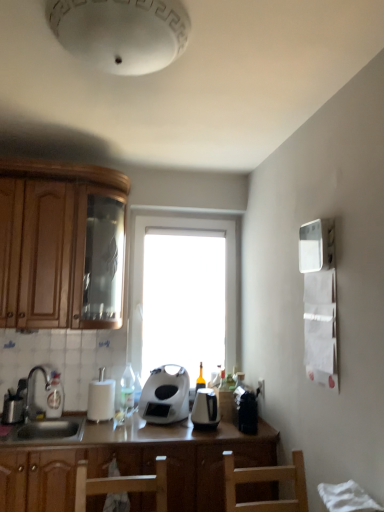
This screenshot has height=512, width=384. In order to click on free space to the right of brushed metal faucet at lower left in this screenshot , I will do `click(62, 422)`.